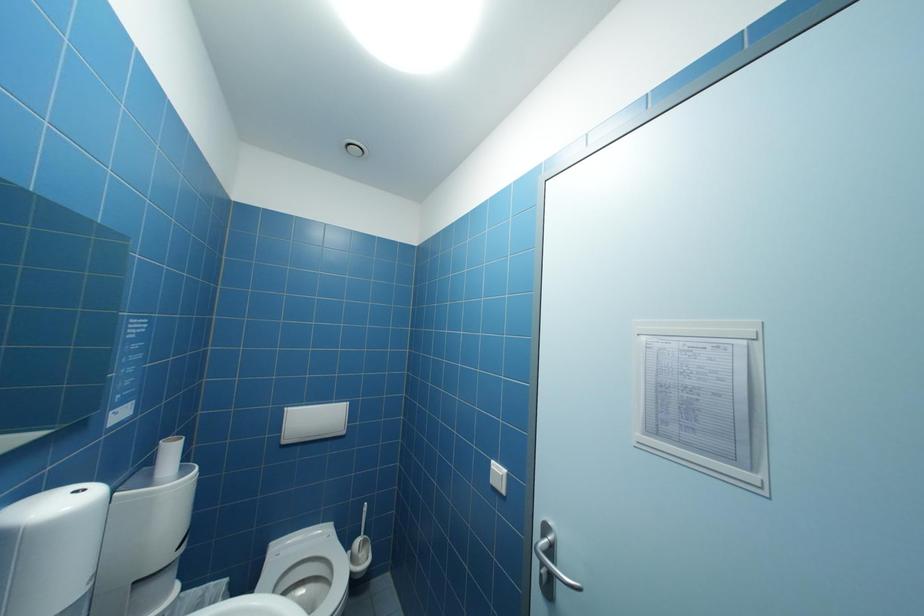
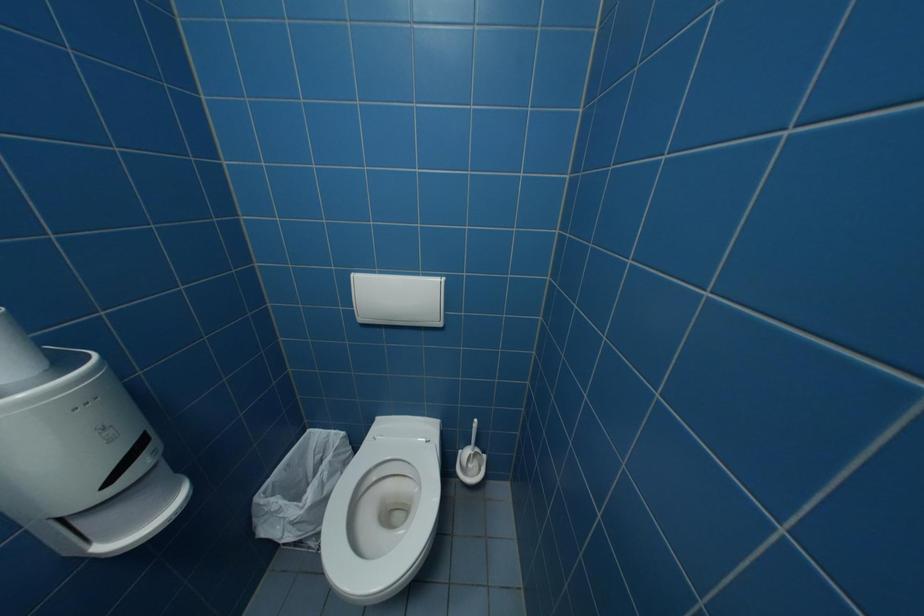
The first image is from the beginning of the video and the second image is from the end. How did the camera likely rotate when shooting the video?

The rotation direction of the camera is left-down.